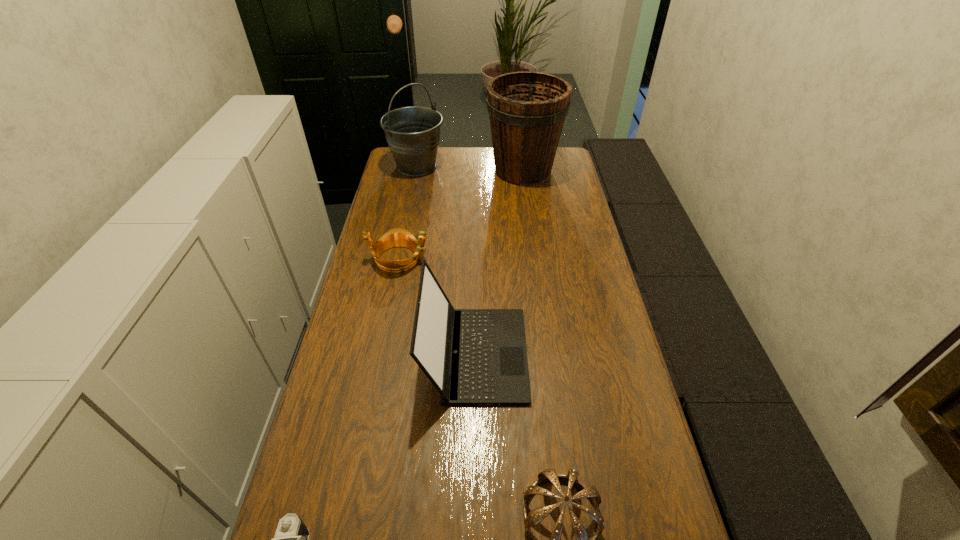
At what (x,y) coordinates should I click in order to perform the action: click on blank region between the left bucket and the right bucket. Please return your answer as a coordinate pair (x, y). This screenshot has height=540, width=960. Looking at the image, I should click on (469, 168).

Image resolution: width=960 pixels, height=540 pixels. I want to click on vacant region between the farther tiara and the right bucket, so click(x=461, y=214).

You are a GUI agent. You are given a task and a screenshot of the screen. Output one action in this format:
    pyautogui.click(x=<x>, y=<y>)
    Task: Click on the free space between the farther tiara and the left bucket
    The height and width of the screenshot is (540, 960).
    Given the screenshot: What is the action you would take?
    pyautogui.click(x=408, y=212)

Choose which object is the nearest neighbor to the laptop. Please provide its 2D coordinates. Your answer should be formatted as a tuple, i.e. [(x, y)], where the tuple contains the x and y coordinates of a point satisfying the conditions above.

[(397, 237)]

Identify the location of object that is the closest to the right bucket. (412, 133).